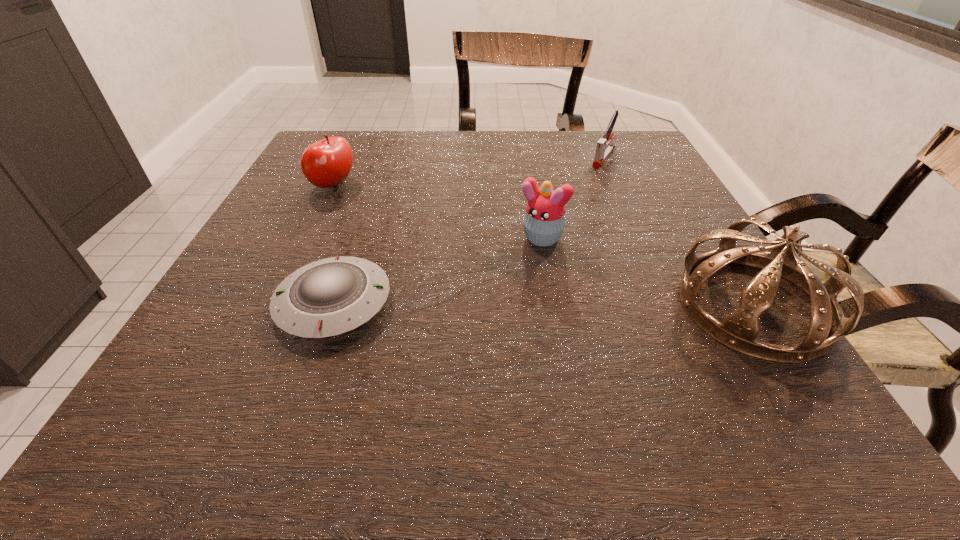
The height and width of the screenshot is (540, 960). Find the location of `the shortest object`. the shortest object is located at coordinates (326, 298).

What are the coordinates of `the tallest object` in the screenshot? It's located at (738, 331).

Identify the location of stapler. (604, 148).

Locate an element on the screen. This screenshot has height=540, width=960. the second shortest object is located at coordinates (604, 148).

You are a GUI agent. You are given a task and a screenshot of the screen. Output one action in this format:
    pyautogui.click(x=<x>, y=<y>)
    Task: Click on the third object from right to left
    
    Given the screenshot: What is the action you would take?
    pyautogui.click(x=544, y=221)

Image resolution: width=960 pixels, height=540 pixels. Find the location of `cupcake`. cupcake is located at coordinates (544, 221).

Locate an element on the screen. Image resolution: width=960 pixels, height=540 pixels. the second farthest object is located at coordinates (326, 163).

This screenshot has width=960, height=540. I want to click on free spot located 0.320m on the back of the shortest object, so click(x=377, y=178).

Identify the location of free region located on the left of the tallest object. The width and height of the screenshot is (960, 540). (446, 306).

The width and height of the screenshot is (960, 540). Identify the location of free spot located 0.100m on the handle side of the farthest object. 586,185.